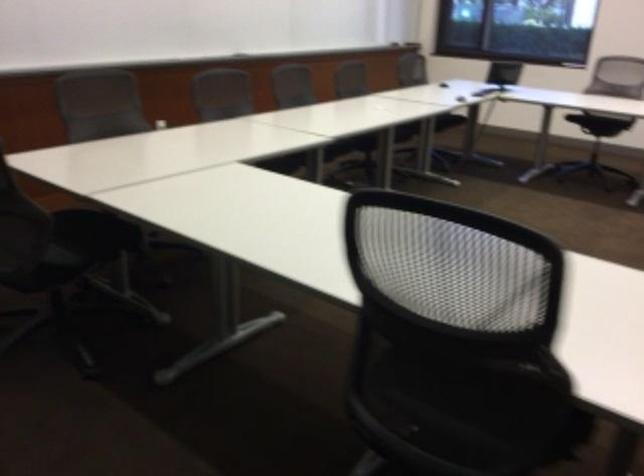
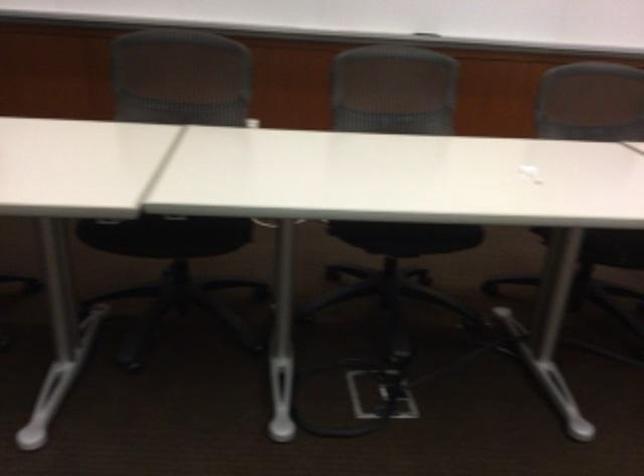
Find the pixel in the second image that matches the point at 289,171 in the first image.

(166, 235)